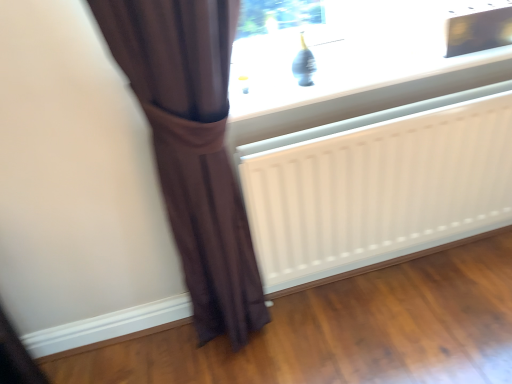
Question: Do you think brown fabric curtain at left is within white matte radiator at lower center, or outside of it?

Choices:
 (A) inside
 (B) outside

Answer: (B)

Question: Considering the positions of brown fabric curtain at left and white matte radiator at lower center in the image, is brown fabric curtain at left bigger or smaller than white matte radiator at lower center?

Choices:
 (A) big
 (B) small

Answer: (A)

Question: Which object is the farthest from the white matte radiator at lower center?

Choices:
 (A) matte glass window at upper center
 (B) brown fabric curtain at left

Answer: (B)

Question: Which object is positioned farthest from the white matte radiator at lower center?

Choices:
 (A) brown fabric curtain at left
 (B) matte glass window at upper center

Answer: (A)